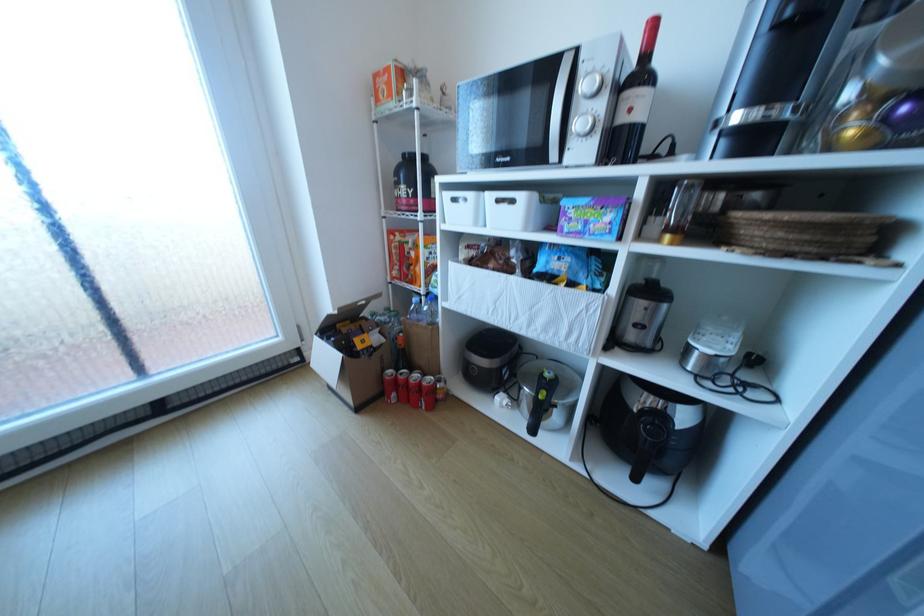
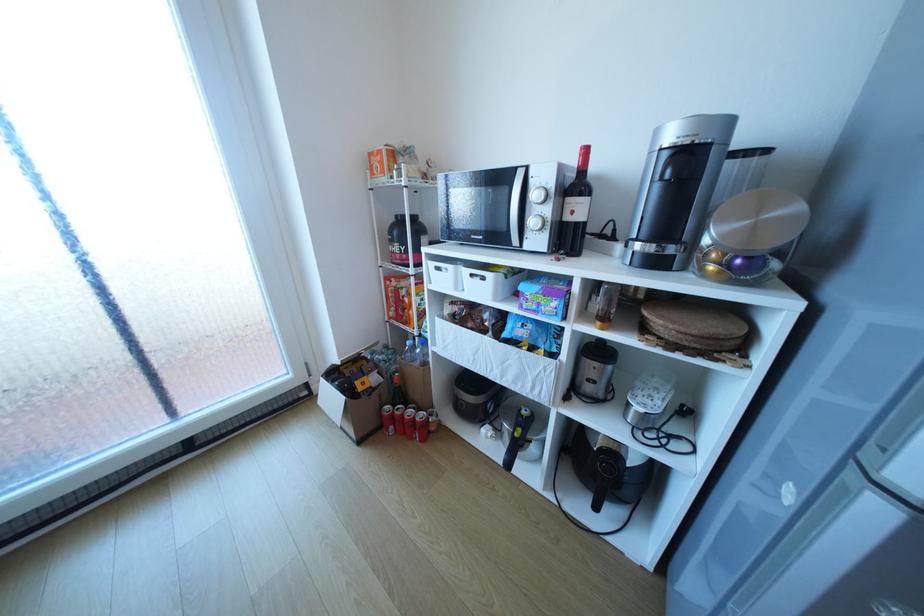
The point at (506,201) is marked in the first image. Where is the corresponding point in the second image?

(481, 275)